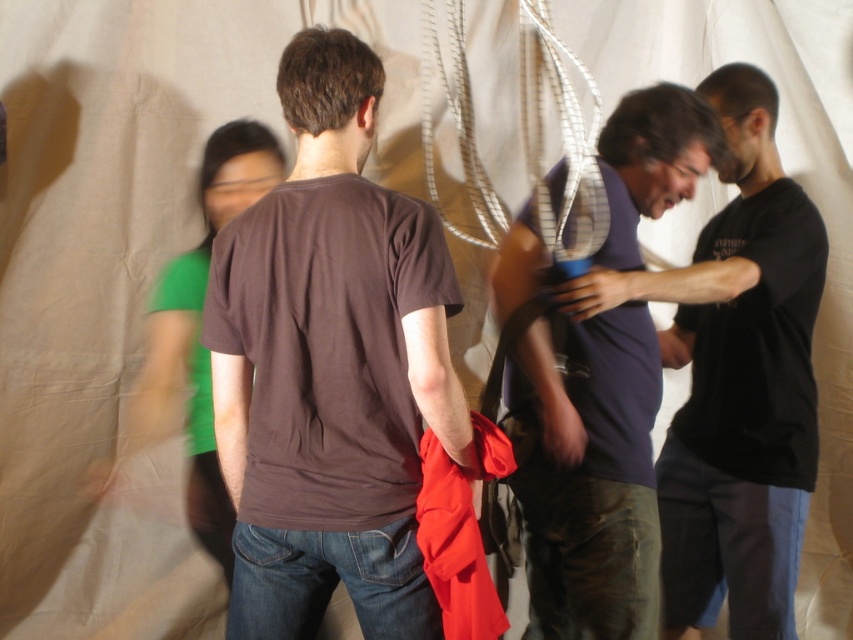
Question: Is brown matte t-shirt at center thinner than matte blue shirt at center?

Choices:
 (A) no
 (B) yes

Answer: (B)

Question: Can you confirm if brown matte t-shirt at center is positioned below matte blue shirt at center?

Choices:
 (A) no
 (B) yes

Answer: (A)

Question: Which of the following is the farthest from the observer?

Choices:
 (A) (604, 556)
 (B) (280, 262)

Answer: (A)

Question: Which point appears closest to the camera in this image?

Choices:
 (A) (288, 195)
 (B) (596, 464)

Answer: (A)

Question: From the image, what is the correct spatial relationship of brown matte t-shirt at center in relation to matte blue shirt at center?

Choices:
 (A) right
 (B) left

Answer: (B)